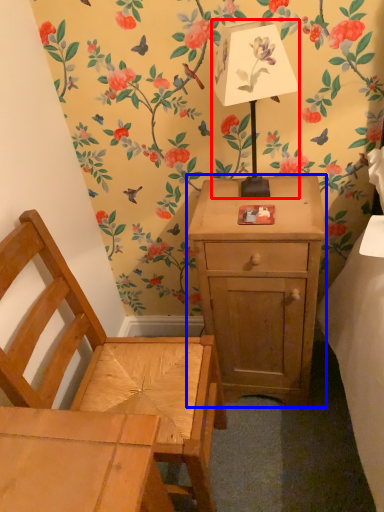
Question: Which point is further to the camera, table lamp (highlighted by a red box) or nightstand (highlighted by a blue box)?

Choices:
 (A) table lamp
 (B) nightstand

Answer: (B)